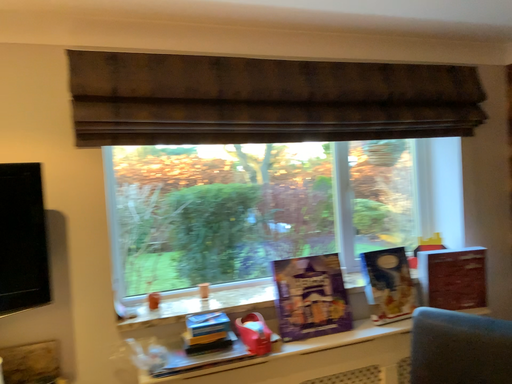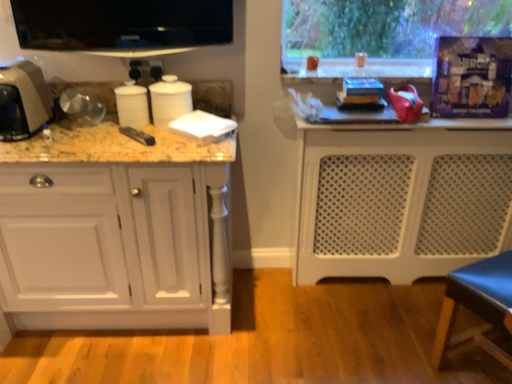
Question: How did the camera likely rotate when shooting the video?

Choices:
 (A) rotated upward
 (B) rotated downward

Answer: (B)